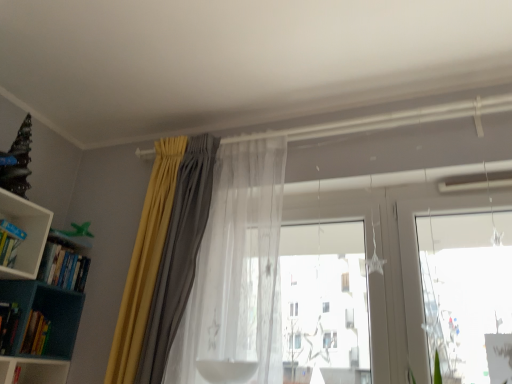
Question: From the image's perspective, is hardcover book at lower left, arranged as the 2th book when ordered from the bottom, located beneath translucent fabric at center?

Choices:
 (A) yes
 (B) no

Answer: (A)

Question: Can you see hardcover book at lower left, which is the 3th book in top-to-bottom order, touching translucent fabric at center?

Choices:
 (A) no
 (B) yes

Answer: (A)

Question: Considering the relative sizes of hardcover book at lower left, which is the 3th book in top-to-bottom order, and translucent fabric at center in the image provided, is hardcover book at lower left, which is the 3th book in top-to-bottom order, taller than translucent fabric at center?

Choices:
 (A) no
 (B) yes

Answer: (A)

Question: Does hardcover book at lower left, arranged as the 2th book when ordered from the bottom, lie behind translucent fabric at center?

Choices:
 (A) no
 (B) yes

Answer: (B)

Question: From a real-world perspective, is hardcover book at lower left, arranged as the 2th book when ordered from the bottom, positioned under translucent fabric at center based on gravity?

Choices:
 (A) yes
 (B) no

Answer: (A)

Question: Is hardcover book at lower left, arranged as the 2th book when ordered from the bottom, turned away from translucent fabric at center?

Choices:
 (A) no
 (B) yes

Answer: (A)

Question: Is hardcover book at lower left, arranged as the 2th book when ordered from the bottom, smaller than teal plastic bookcase at left?

Choices:
 (A) yes
 (B) no

Answer: (A)

Question: Is hardcover book at lower left, which is the 3th book in top-to-bottom order, positioned with its back to teal plastic bookcase at left?

Choices:
 (A) no
 (B) yes

Answer: (B)

Question: Does hardcover book at lower left, arranged as the 2th book when ordered from the bottom, lie behind teal plastic bookcase at left?

Choices:
 (A) yes
 (B) no

Answer: (A)

Question: From the image's perspective, is hardcover book at lower left, arranged as the 2th book when ordered from the bottom, over teal plastic bookcase at left?

Choices:
 (A) no
 (B) yes

Answer: (A)

Question: Considering the relative sizes of hardcover book at lower left, arranged as the 2th book when ordered from the bottom, and teal plastic bookcase at left in the image provided, is hardcover book at lower left, arranged as the 2th book when ordered from the bottom, wider than teal plastic bookcase at left?

Choices:
 (A) yes
 (B) no

Answer: (B)

Question: From a real-world perspective, is hardcover book at lower left, which is the 3th book in top-to-bottom order, below translucent sheer curtain at center, which is the 2th curtain from left to right?

Choices:
 (A) yes
 (B) no

Answer: (A)